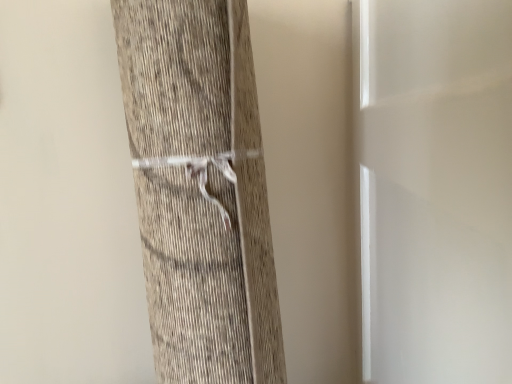
Locate an element on the screen. The height and width of the screenshot is (384, 512). white glossy door at right is located at coordinates (x=434, y=189).

Describe the element at coordinates (434, 189) in the screenshot. I see `white glossy door at right` at that location.

Locate an element on the screen. The image size is (512, 384). white glossy door at right is located at coordinates (434, 189).